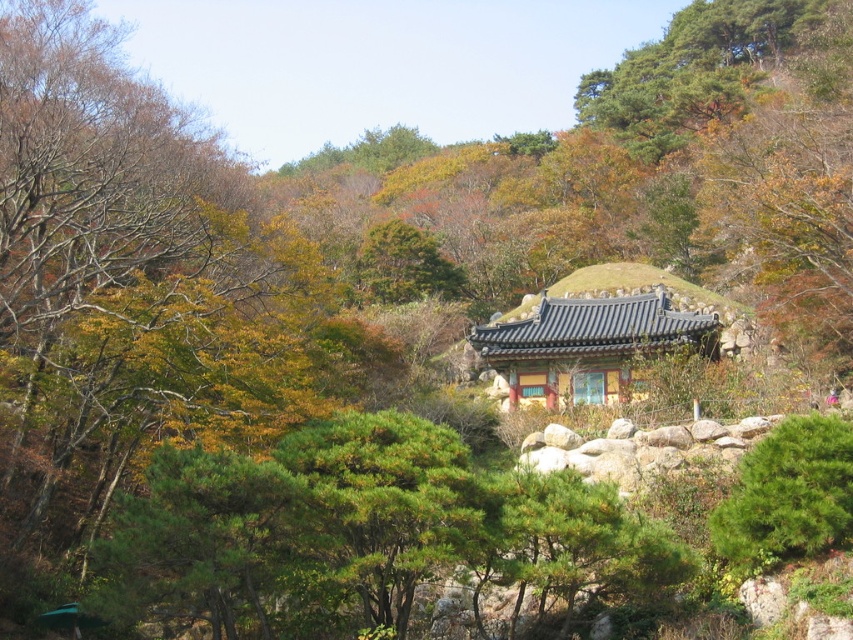
Question: Does yellowish wood temple at center have a smaller size compared to green matte tree at center?

Choices:
 (A) yes
 (B) no

Answer: (B)

Question: Can you confirm if yellowish wood temple at center is positioned to the right of green matte tree at center?

Choices:
 (A) yes
 (B) no

Answer: (B)

Question: Which object is closer to the camera taking this photo?

Choices:
 (A) yellowish wood temple at center
 (B) green matte tree at center

Answer: (B)

Question: Which point is closer to the camera?

Choices:
 (A) yellowish wood temple at center
 (B) green matte tree at center

Answer: (B)

Question: Does yellowish wood temple at center appear on the right side of green matte tree at center?

Choices:
 (A) no
 (B) yes

Answer: (A)